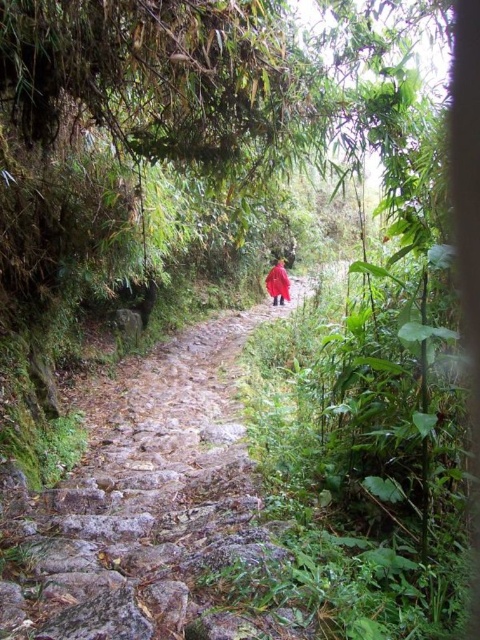
You are a hiker carrying a heavy backpack and need to climb up the path. You see the rustic stone steps at center and the red matte jacket at center. Which object is closer to you as you start ascending the path?

The rustic stone steps at center is in front of the red matte jacket at center, so the rustic stone steps at center is closer to you as you start ascending the path.

You are a hiker who has just arrived at the rustic stone steps at center and the red matte jacket at center. Which object is positioned higher up the path?

The red matte jacket at center is positioned higher up the path because the rustic stone steps at center is located below it.

You are a hiker walking along the narrow stone path in the forest. You notice two points marked on your map at coordinates point (212, 484) and point (285, 268). As you walk forward, which point will you encounter first?

Point (212, 484) will be encountered first because it is positioned in front of point (285, 268) along the path.